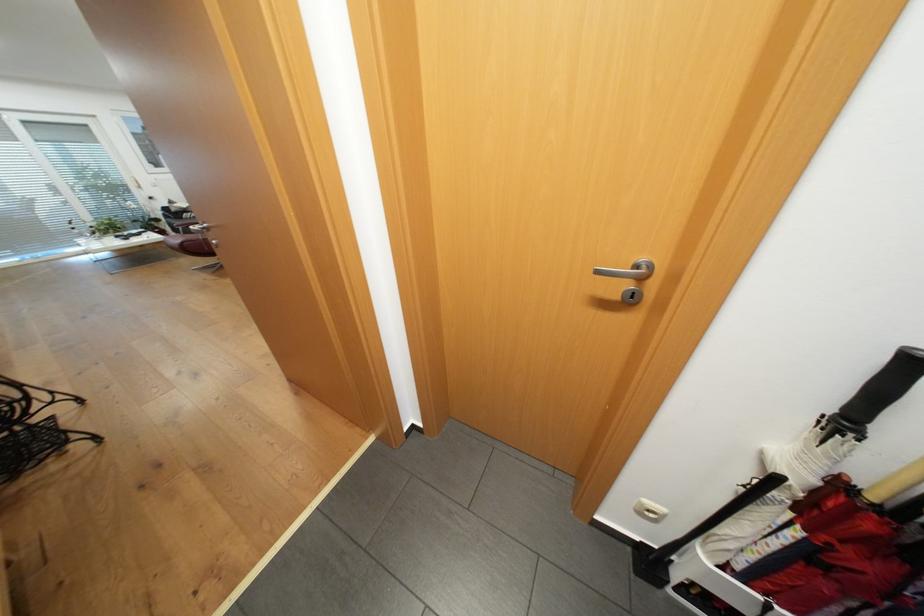
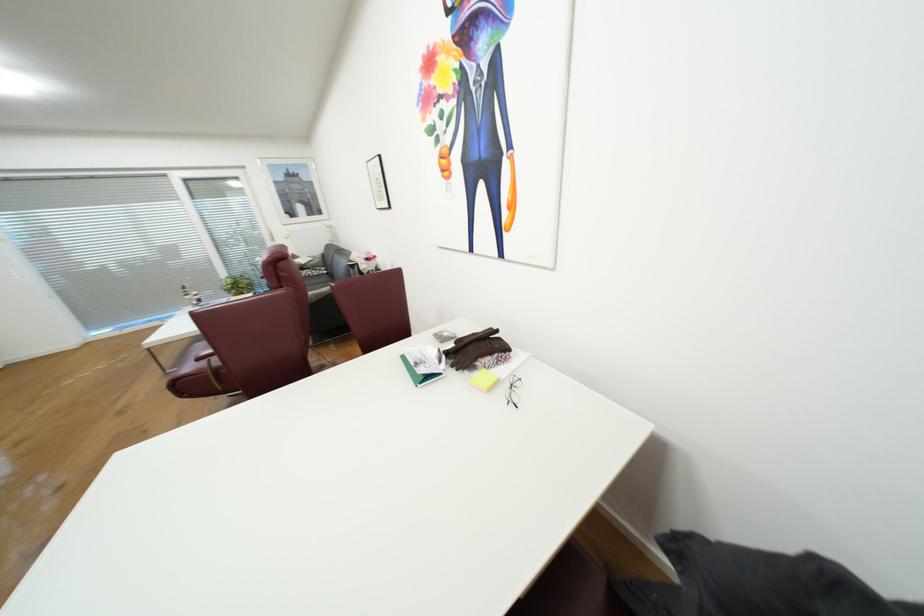
Which direction would the cameraman need to move to produce the second image?

The cameraman walked toward left, forward.